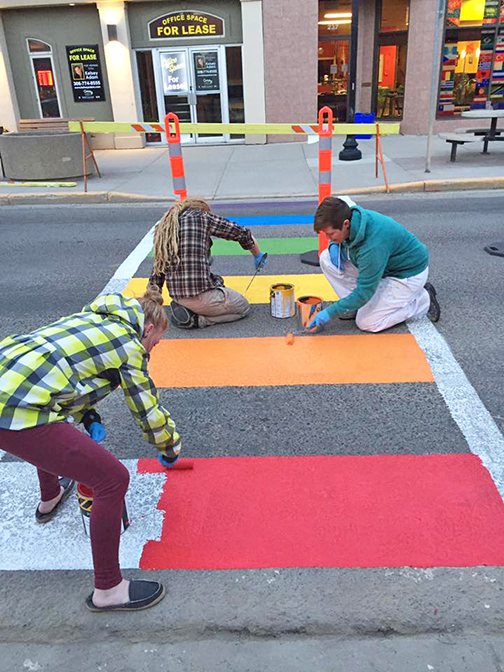
Identify the location of windows. The height and width of the screenshot is (672, 504). (x=144, y=91), (x=177, y=106), (x=234, y=72), (x=208, y=105), (x=46, y=99), (x=337, y=54), (x=392, y=60), (x=469, y=56).